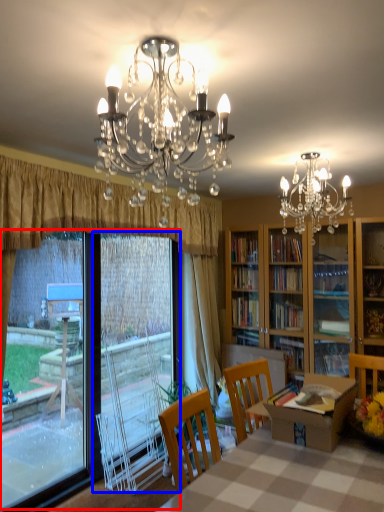
Question: Which of the following is the farthest to the observer, window screen (highlighted by a red box) or screen door (highlighted by a blue box)?

Choices:
 (A) window screen
 (B) screen door

Answer: (B)